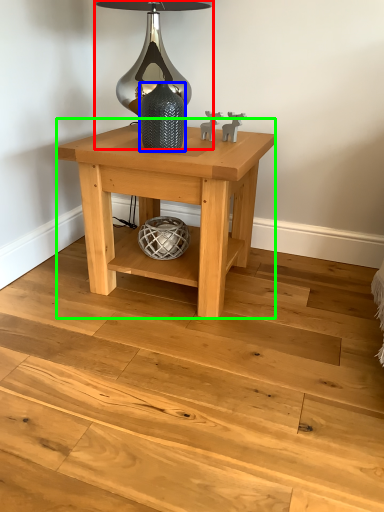
Question: Which object is positioned closest to table lamp (highlighted by a red box)? Select from glass vase (highlighted by a blue box) and table (highlighted by a green box).

Choices:
 (A) glass vase
 (B) table

Answer: (A)